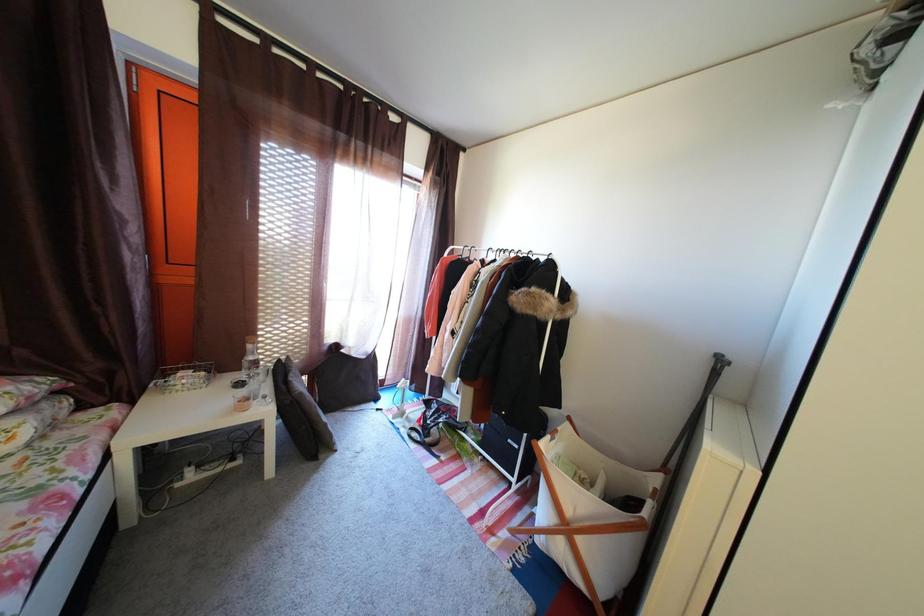
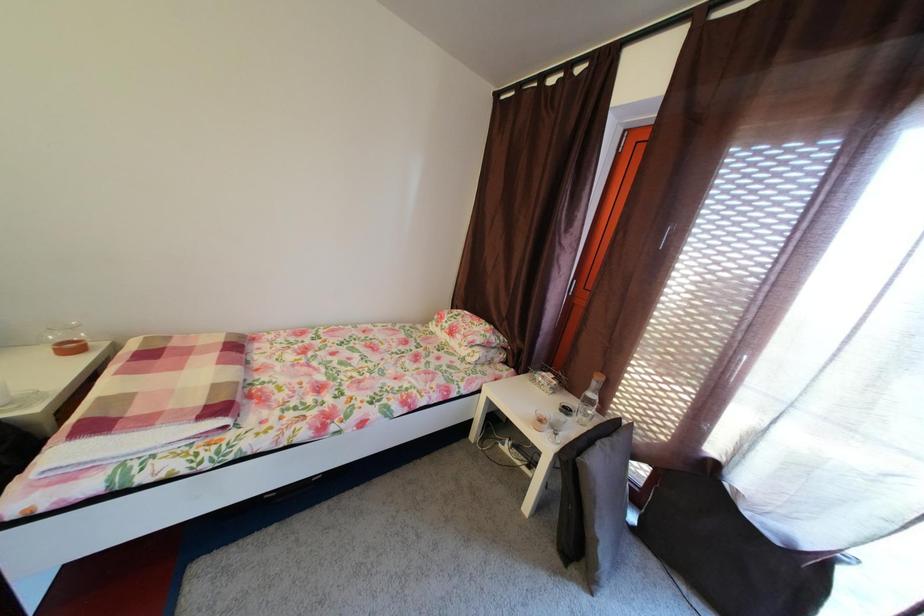
Question: How did the camera likely rotate?

Choices:
 (A) Left
 (B) Right
 (C) Up
 (D) Down

Answer: (A)